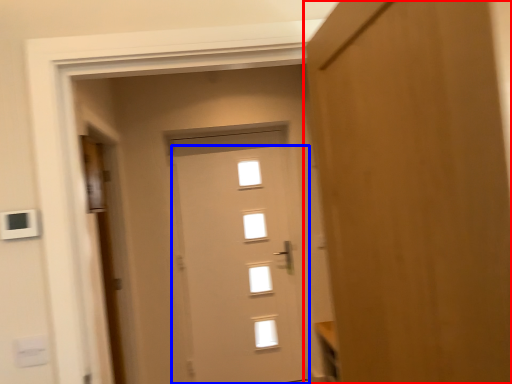
Question: Which object is closer to the camera taking this photo, door (highlighted by a red box) or door (highlighted by a blue box)?

Choices:
 (A) door
 (B) door

Answer: (A)